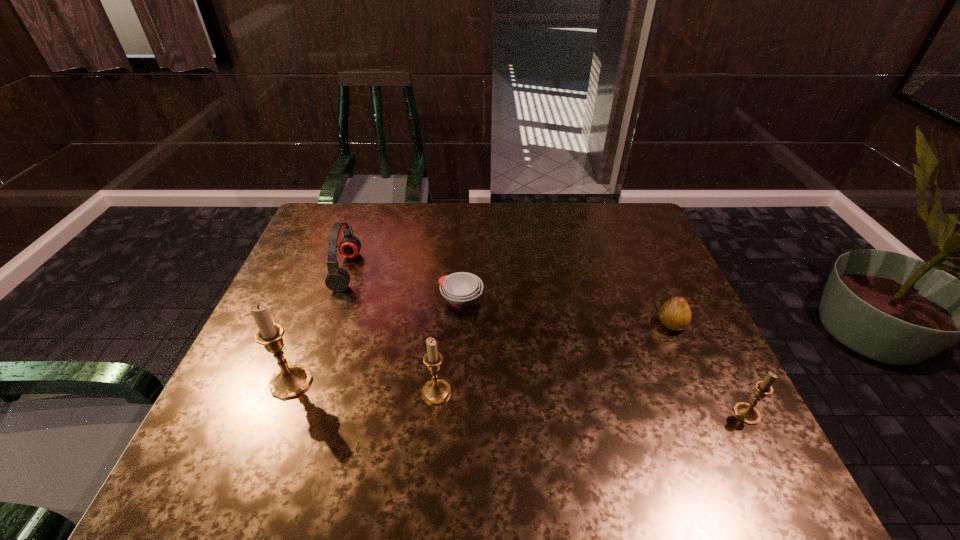
Please determine a free point for an extra candle_holder to ensure balance. Please provide its 2D coordinates. Your answer should be formatted as a tuple, i.e. [(x, y)], where the tuple contains the x and y coordinates of a point satisfying the conditions above.

[(588, 403)]